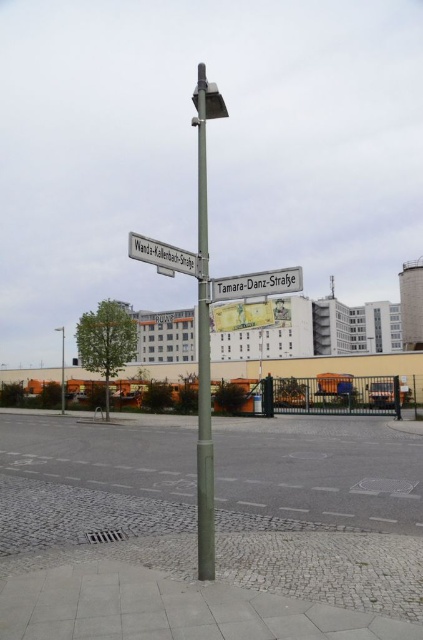
Consider the image. You are a delivery driver who needs to park your vehicle in the gray cobblestone parking lot at lower center. According to the image, where exactly is this parking lot located in relation to the street signpost and the industrial building?

The gray cobblestone parking lot at lower center is located at point coordinates (321, 470). This places it near the lower central part of the image, between the street signpost and the industrial building, closer to the building than the signpost.

You are a city planner checking the dimensions of the street sign and pole. Which object has a smaller width between the metallic silver street sign at center and the matte green pole at center?

The metallic silver street sign at center has a smaller width compared to the matte green pole at center.

You are a delivery driver who needs to park your truck in the gray cobblestone parking lot at lower center. The truck requires a space that is wider than the white plastic street sign at upper left. Can the parking lot accommodate your truck?

The gray cobblestone parking lot at lower center has a width larger than the white plastic street sign at upper left, so yes, the parking lot can accommodate the truck as it meets the required width.